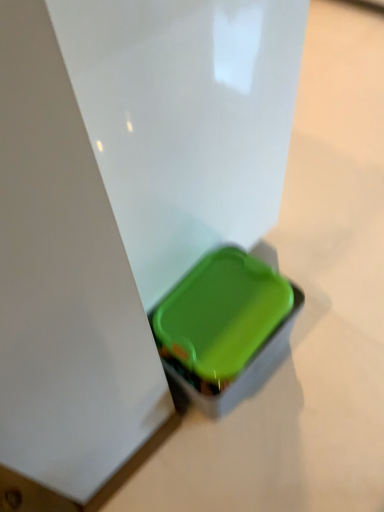
You are a GUI agent. You are given a task and a screenshot of the screen. Output one action in this format:
    pyautogui.click(x=<x>, y=<y>)
    Task: Click on the free spot above green plastic container at lower center (from a real-world perspective)
    Image resolution: width=384 pixels, height=512 pixels.
    Given the screenshot: What is the action you would take?
    pyautogui.click(x=202, y=327)